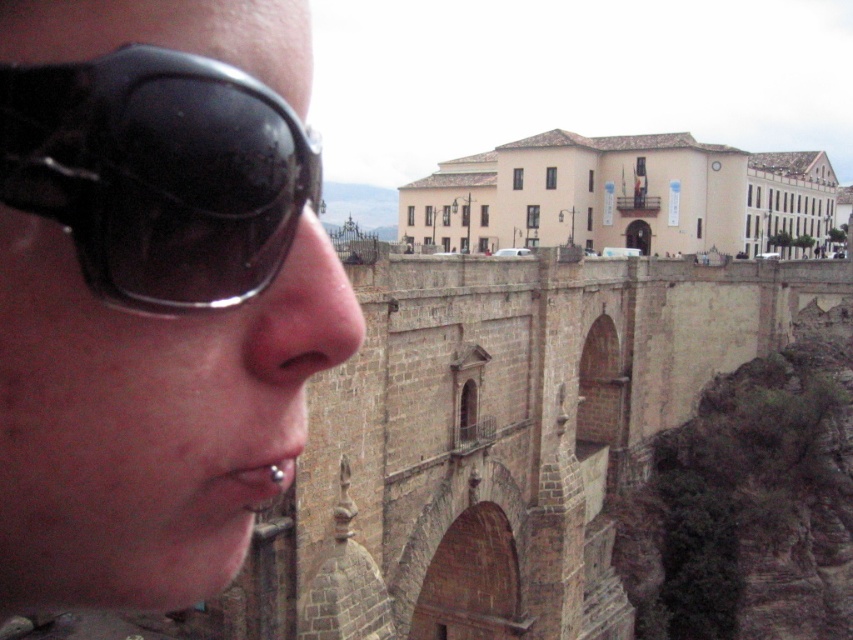
Is black shiny sunglasses at left taller than matte skin nose at center?

Incorrect, black shiny sunglasses at left's height is not larger of matte skin nose at center's.

Between point (123, 224) and point (328, 355), which one is positioned behind?

Point (328, 355)

Locate an element on the screen. The height and width of the screenshot is (640, 853). black shiny sunglasses at left is located at coordinates (160, 173).

At what (x,y) coordinates should I click in order to perform the action: click on black shiny sunglasses at left. Please return your answer as a coordinate pair (x, y). Looking at the image, I should click on (160, 173).

Which is in front, point (201, 424) or point (294, 387)?

Point (201, 424)

Looking at this image, between black matte sunglasses at left and matte skin nose at center, which one has more height?

Standing taller between the two is black matte sunglasses at left.

Does point (158, 406) lie in front of point (248, 323)?

Yes, it is.

This screenshot has width=853, height=640. I want to click on black matte sunglasses at left, so click(x=152, y=289).

Is the position of black shiny sunglasses at left more distant than that of silver metallic piercing at lower left?

No, it is in front of silver metallic piercing at lower left.

Is black shiny sunglasses at left to the left of silver metallic piercing at lower left from the viewer's perspective?

In fact, black shiny sunglasses at left is to the right of silver metallic piercing at lower left.

Identify the location of black shiny sunglasses at left. (160, 173).